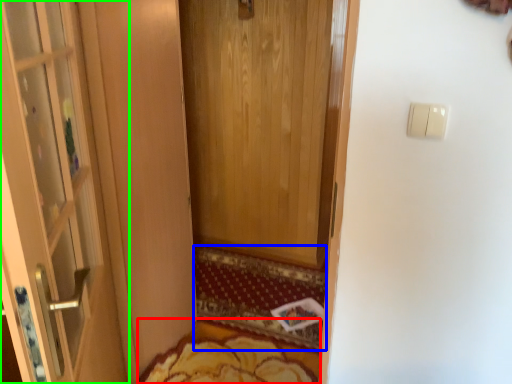
Question: Which object is positioned closest to mat (highlighted by a red box)? Select from doormat (highlighted by a blue box) and door (highlighted by a green box).

Choices:
 (A) doormat
 (B) door

Answer: (A)